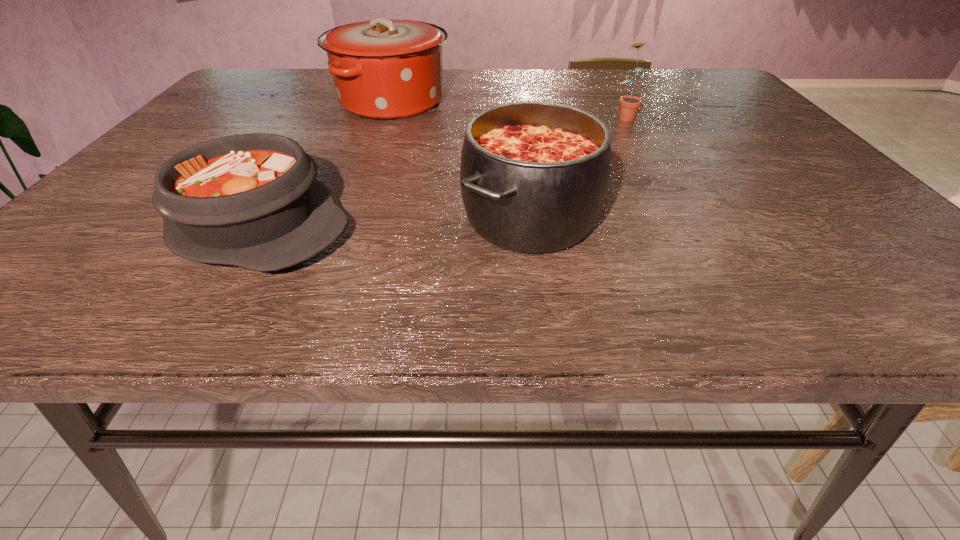
Find the location of `the farthest casserole`. the farthest casserole is located at coordinates (383, 69).

At what (x,y) coordinates should I click in order to perform the action: click on sunflower. Please return your answer as a coordinate pair (x, y). This screenshot has height=540, width=960. Looking at the image, I should click on (630, 105).

Identify the location of the second shortest casserole. The image size is (960, 540). (534, 176).

Find the location of a particular element. This screenshot has height=540, width=960. the third object from left to right is located at coordinates (534, 176).

The width and height of the screenshot is (960, 540). I want to click on the shortest object, so click(251, 200).

Identify the location of vacant space situated on the right of the tallest casserole. This screenshot has height=540, width=960. (539, 101).

Locate an element on the screen. This screenshot has width=960, height=540. free space located 0.220m on the flower of the rightmost object is located at coordinates (655, 166).

At what (x,y) coordinates should I click in order to perform the action: click on free space located on the left of the rightmost casserole. Please return your answer as a coordinate pair (x, y). Looking at the image, I should click on (407, 218).

At what (x,y) coordinates should I click in order to perform the action: click on vacant area situated 0.270m on the right of the shortest casserole. Please return your answer as a coordinate pair (x, y). Image resolution: width=960 pixels, height=540 pixels. Looking at the image, I should click on (506, 225).

Image resolution: width=960 pixels, height=540 pixels. What are the coordinates of `object that is at the far edge` in the screenshot? It's located at (383, 69).